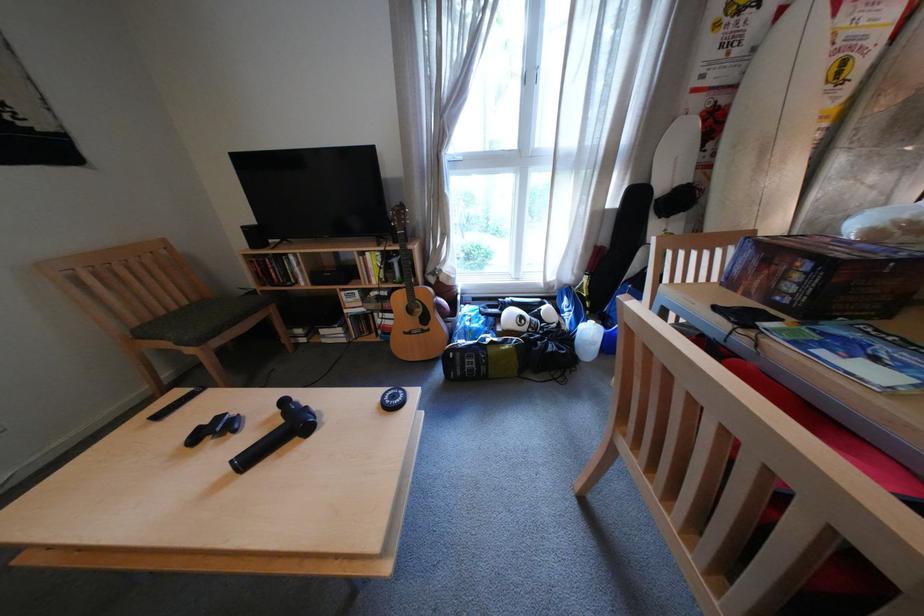
Locate an element on the screen. This screenshot has width=924, height=616. wooden chair seat is located at coordinates (157, 304).